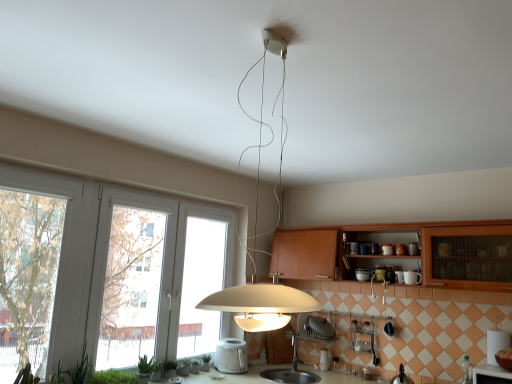
This screenshot has height=384, width=512. In order to click on free space in front of white glossy toaster at center, which appears as the 1th appliance when viewed from the right in this screenshot , I will do `click(330, 369)`.